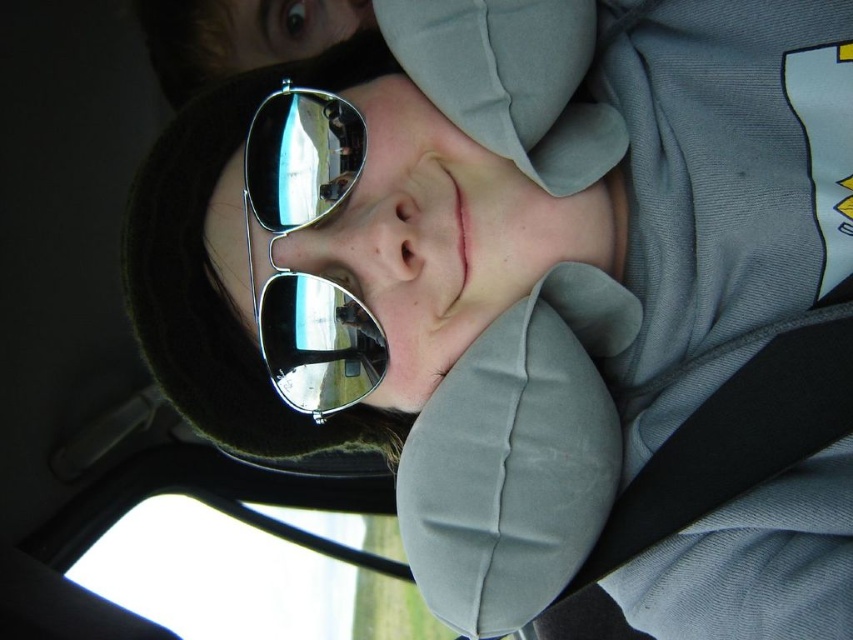
You are a passenger in a car and want to look outside through the transparent glass car window at lower left. However, the metallic reflective sunglasses at center are blocking your view. Which object should you move to see outside?

You should move the metallic reflective sunglasses at center to the right side of the transparent glass car window at lower left since the sunglasses are currently blocking the view by being on the left side of the window.

You are a delivery robot standing outside a car and want to hand a package to the person inside. The package is 1.2 meters wide. Can you fit the package through the transparent glass car window at lower left to give it to them?

The transparent glass car window at lower left and viewer are 1.35 meters apart from each other. Since the package is 1.2 meters wide, which is narrower than the 1.35 meters distance between the window and the viewer, the package can fit through the window.

You are a passenger in a car and want to look outside through the transparent glass car window at lower left while wearing the metallic reflective sunglasses at center. Can you see the outside clearly through the sunglasses?

The transparent glass car window at lower left has a larger size compared to metallic reflective sunglasses at center, so yes, you can see the outside clearly through the metallic reflective sunglasses at center because the sunglasses do not obstruct the entire window view.